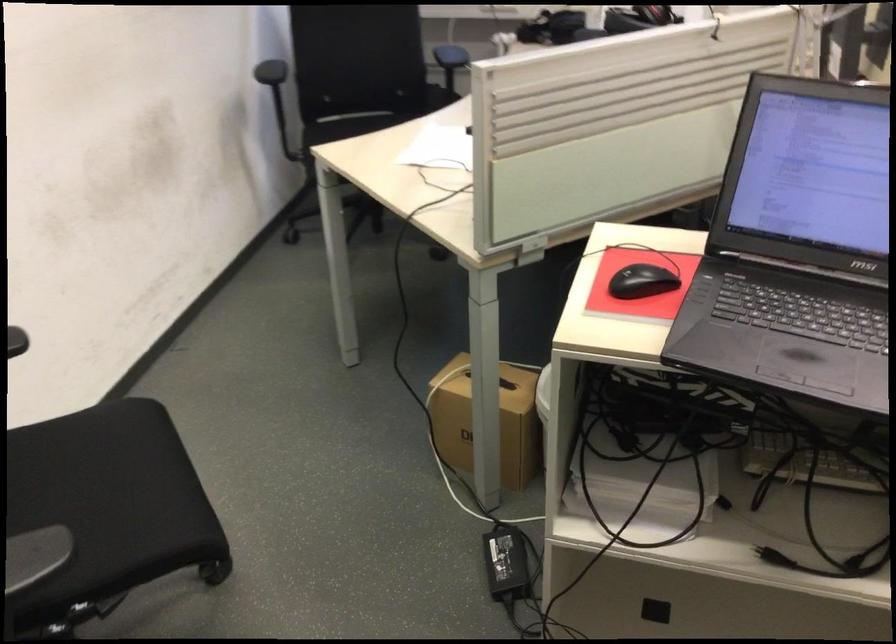
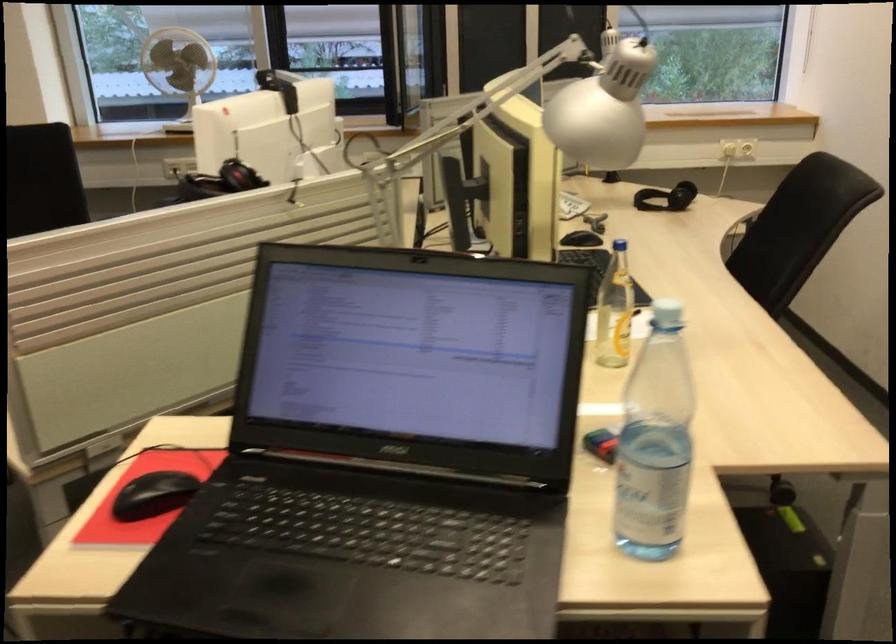
Question: Based on the continuous images, in which direction is the camera rotating? Reply with the corresponding letter.

Choices:
 (A) Left
 (B) Right
 (C) Up
 (D) Down

Answer: (B)